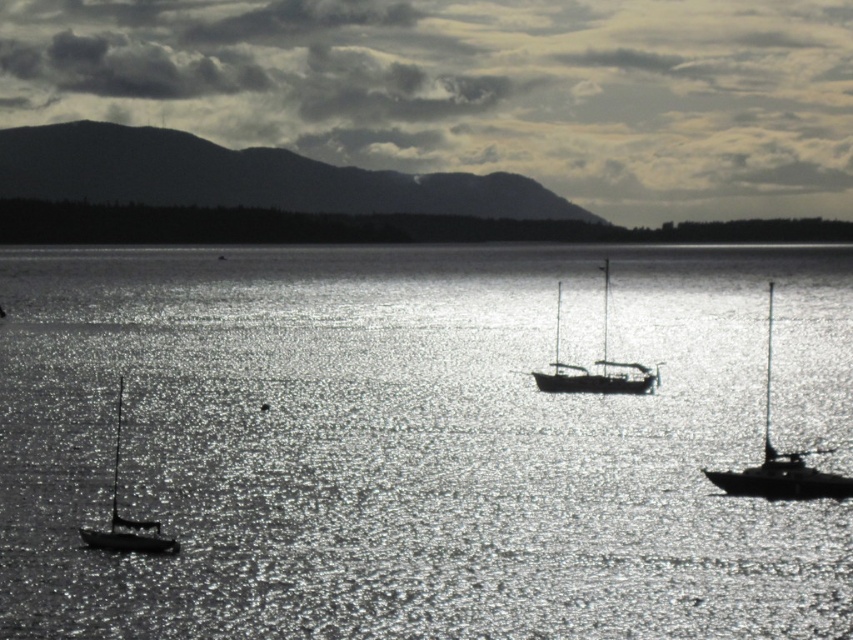
You are a photographer trying to capture the silvery metallic sailboat at center and the sparkling silver water at center in a single shot. Based on their positions, which object should you adjust your camera to focus on first if you want to ensure both are in frame?

The sparkling silver water at center is to the left of the silvery metallic sailboat at center, so you should focus on the silvery metallic sailboat at center first to ensure both are in frame.

You are a photographer planning to capture the reflection of the silvery metallic sailboat at right on the sparkling silver water at center. Based on the scene description, will the reflection of the sailboat be larger or smaller than the actual boat?

The sparkling silver water at center is bigger than the silvery metallic sailboat at right, so the reflection of the sailboat will be smaller than the actual boat.